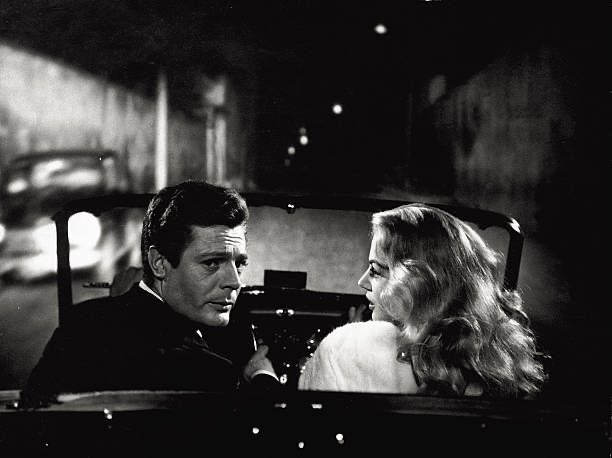
Where is `light`? This screenshot has height=458, width=612. light is located at coordinates (381, 30), (336, 106), (303, 142), (288, 154), (84, 230).